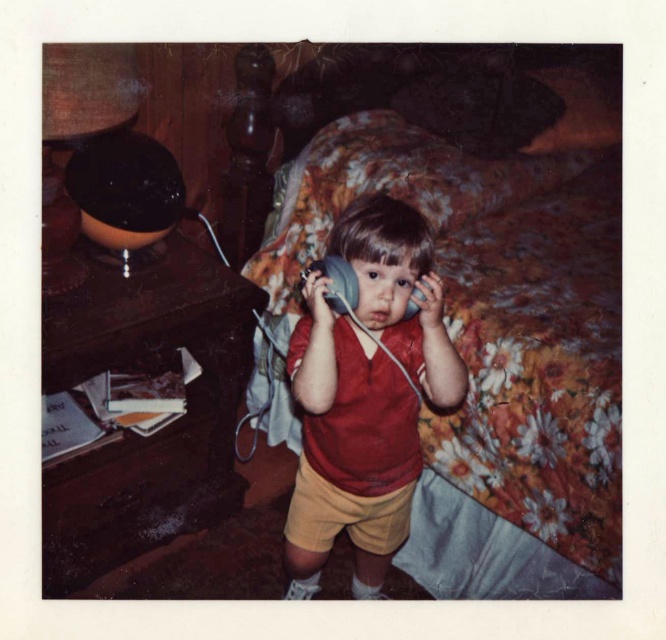
Find the location of `floral fabric bed at center`. floral fabric bed at center is located at coordinates (488, 291).

Image resolution: width=666 pixels, height=640 pixels. In order to click on floral fabric bed at center in this screenshot , I will do `click(488, 291)`.